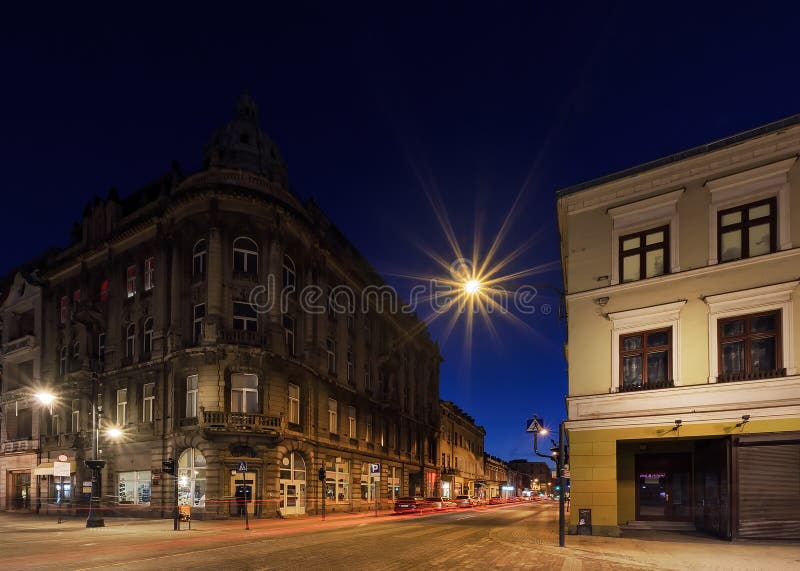
I want to click on lamp, so click(x=114, y=430).